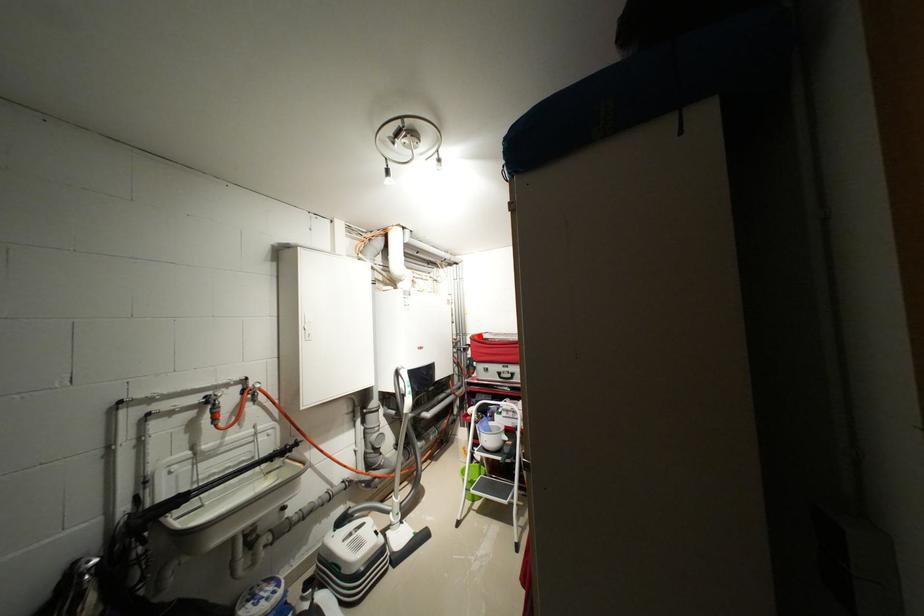
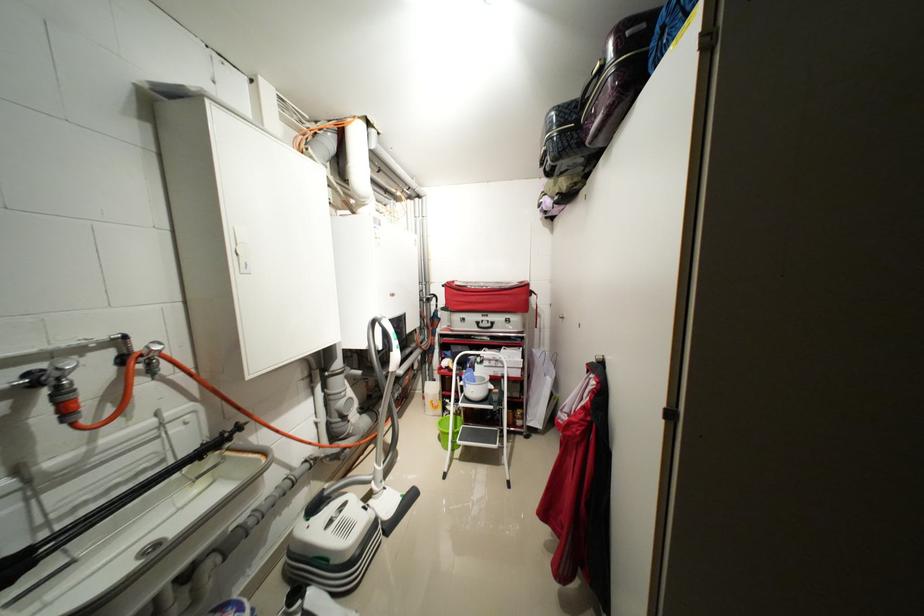
Find the pixel in the second image that matches the highlighted location in the first image.

(455, 284)